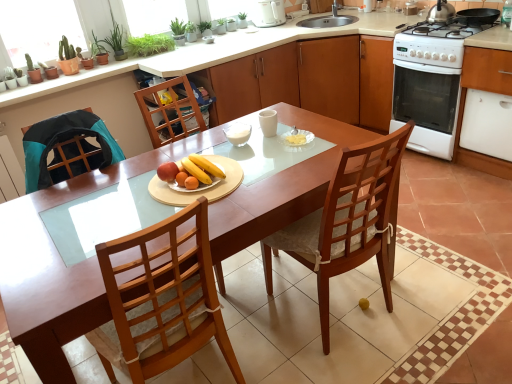
This screenshot has height=384, width=512. What are the coordinates of `free space that is to the left of smooth wooden plate with fruits at center, the second fruit dish from the right` in the screenshot? It's located at (106, 198).